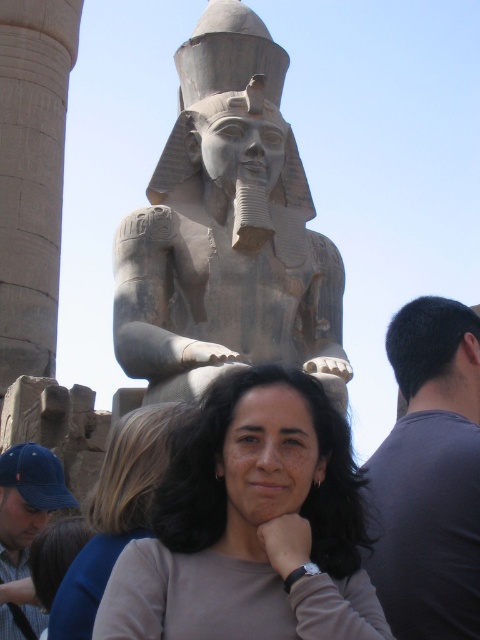
You are an archaeologist examining the ancient Egyptian site. You notice the matte gray statue at center and the smooth stone column at left. Which object takes up more space in the image?

The smooth stone column at left occupies more space than the matte gray statue at center.

You are an archaeologist standing in front of the matte gray statue at center and the smooth stone column at left. Which object is closer to you?

The matte gray statue at center is closer to you since it is in front of the smooth stone column at left.